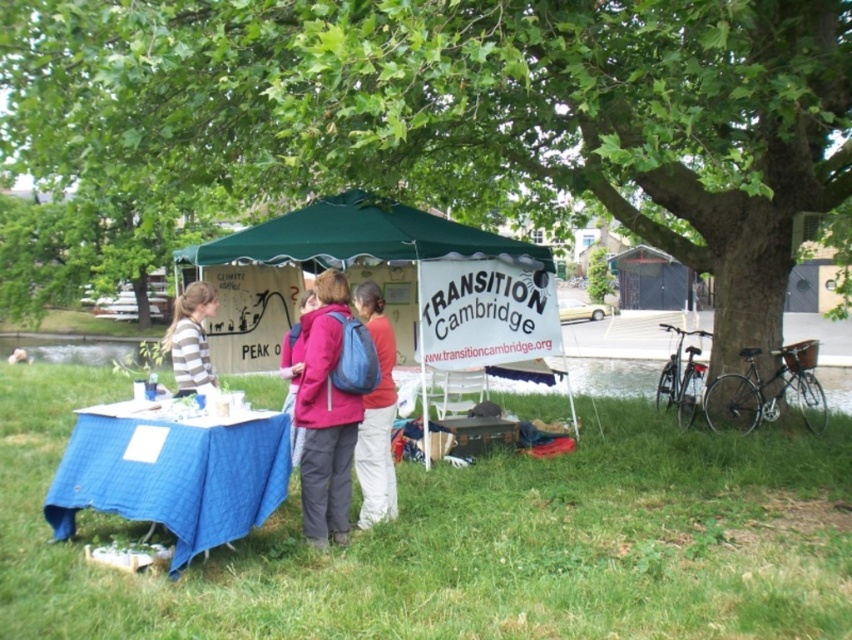
You are a hiker who just arrived at the park. You see the green fabric tent at center and the matte blue backpack at center. Which object is positioned to the left?

The green fabric tent at center is positioned to the left of the matte blue backpack at center.

You are standing at the entrance of the tent with the banner reading TRANSITION Cambridge. Looking around, you notice a point marked at coordinates (463, 113). What object is located at this point?

The point at coordinates (463, 113) corresponds to the green leafy tree at upper center.

You are standing at the entrance of the park and see the green fabric tent at center. If you walk straight towards the tent, will you first encounter the tent before reaching the water visible in the background?

The green fabric tent at center is located at point (416, 273), which is closer to the entrance than the water in the background. Therefore, you will encounter the tent before reaching the water.